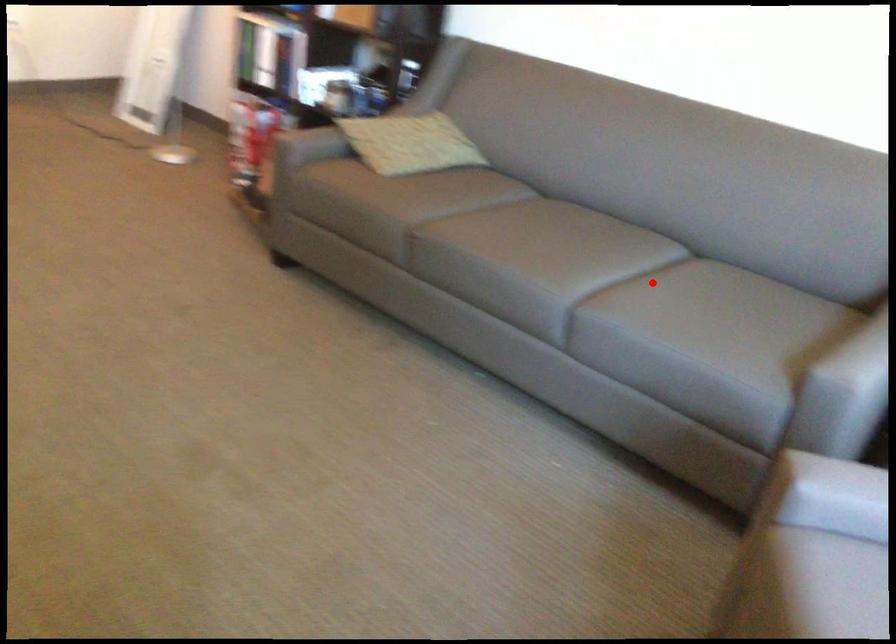
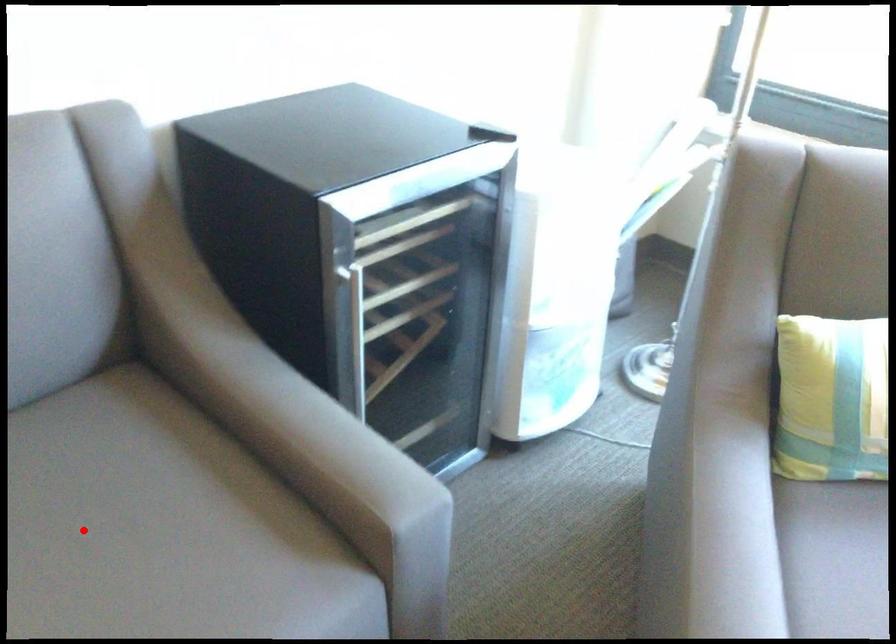
I am providing you with two images of the same scene from different viewpoints. A red point is marked on the first image and another point is marked on the second image. Do the highlighted points in image1 and image2 indicate the same real-world spot?

Yes